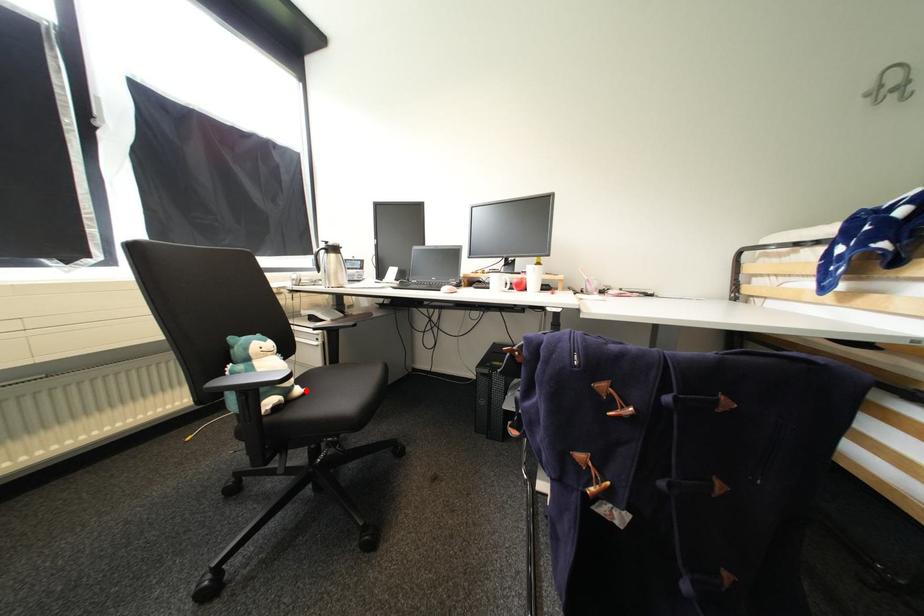
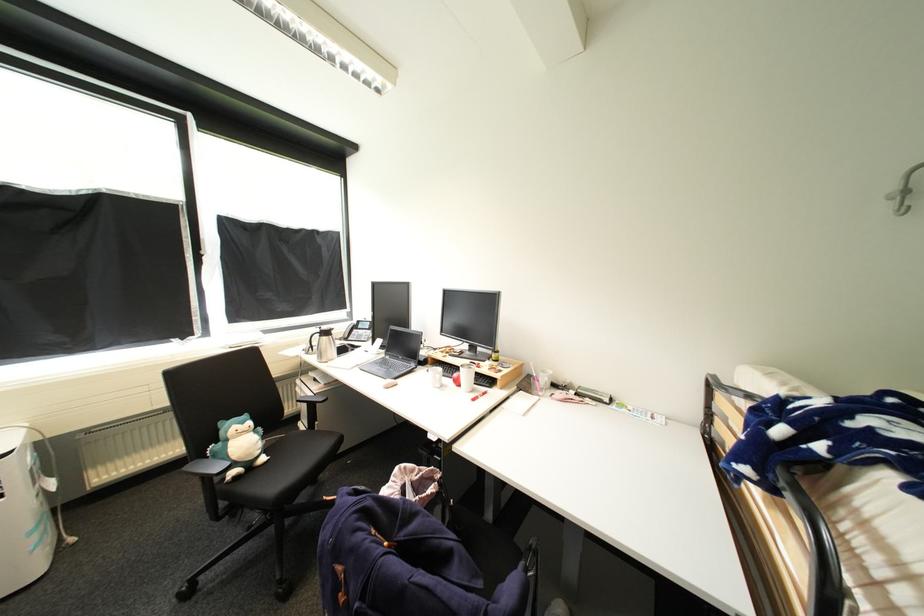
Question: I am providing you with two images of the same scene from different viewpoints. A red point is marked on the first image. Can you still see the location of the red point in image 2?

Choices:
 (A) Yes
 (B) No

Answer: (A)